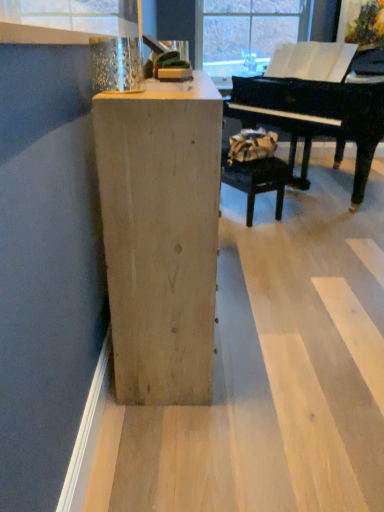
What is the approximate height of metallic glass at upper left?

It is 11.00 inches.

In order to face natural wood cabinet at center, should I rotate leftwards or rightwards?

A 2.473 degree turn to the left will do.

Measure the distance between leather-like brown bag at center and camera.

leather-like brown bag at center and camera are 9.96 feet apart from each other.

Where is `black polished piano at upper right`? black polished piano at upper right is located at coordinates (315, 109).

Are natural wood cabinet at center and metallic glass at upper left far apart?

That's not correct — natural wood cabinet at center is a little close to metallic glass at upper left.

Considering the points (163, 371) and (91, 6), which point is behind, point (163, 371) or point (91, 6)?

The point (163, 371) is behind.

How far apart are natural wood cabinet at center and metallic glass at upper left?

24.46 inches.

Is natural wood cabinet at center at the left side of metallic glass at upper left?

In fact, natural wood cabinet at center is to the right of metallic glass at upper left.

Between black polished piano at upper right and leather-like brown bag at center, which one appears on the left side from the viewer's perspective?

From the viewer's perspective, leather-like brown bag at center appears more on the left side.

Is black polished piano at upper right inside or outside of leather-like brown bag at center?

black polished piano at upper right cannot be found inside leather-like brown bag at center.

Can you confirm if black polished piano at upper right is wider than leather-like brown bag at center?

Yes, black polished piano at upper right is wider than leather-like brown bag at center.

Who is smaller, black polished piano at upper right or leather-like brown bag at center?

leather-like brown bag at center.

Is leather-like brown bag at center located outside natural wood cabinet at center?

That's correct, leather-like brown bag at center is outside of natural wood cabinet at center.

Does leather-like brown bag at center lie behind natural wood cabinet at center?

Yes, it is behind natural wood cabinet at center.

Is the surface of leather-like brown bag at center in direct contact with natural wood cabinet at center?

No, leather-like brown bag at center is not beside natural wood cabinet at center.

Is leather-like brown bag at center positioned with its back to natural wood cabinet at center?

leather-like brown bag at center is not turned away from natural wood cabinet at center.

Is leather-like brown bag at center aimed at metallic glass at upper left?

No, leather-like brown bag at center is not facing towards metallic glass at upper left.

Is leather-like brown bag at center taller than metallic glass at upper left?

Yes.

From a real-world perspective, which is physically above, leather-like brown bag at center or metallic glass at upper left?

metallic glass at upper left is physically above.

From the image's perspective, which one is positioned higher, leather-like brown bag at center or metallic glass at upper left?

From the image's view, metallic glass at upper left is above.

Which point is more forward, (76, 6) or (139, 98)?

The point (139, 98) is closer to the camera.

Considering the relative sizes of metallic glass at upper left and natural wood cabinet at center in the image provided, is metallic glass at upper left thinner than natural wood cabinet at center?

Yes.

Is metallic glass at upper left with natural wood cabinet at center?

No, metallic glass at upper left is not touching natural wood cabinet at center.

From the picture: Would you say metallic glass at upper left is to the left or to the right of natural wood cabinet at center in the picture?

metallic glass at upper left is to the left of natural wood cabinet at center.

Considering the sizes of objects black polished piano at upper right and metallic glass at upper left in the image provided, who is shorter, black polished piano at upper right or metallic glass at upper left?

metallic glass at upper left.

Which is in front, point (261, 101) or point (79, 9)?

The point (79, 9) is closer.

Is black polished piano at upper right bigger or smaller than metallic glass at upper left?

Considering their sizes, black polished piano at upper right takes up more space than metallic glass at upper left.

Is black polished piano at upper right positioned with its back to metallic glass at upper left?

No.

Does point (201, 321) lie in front of point (274, 65)?

Yes, point (201, 321) is closer to viewer.

How many degrees apart are the facing directions of natural wood cabinet at center and black polished piano at upper right?

The facing directions of natural wood cabinet at center and black polished piano at upper right are 143 degrees apart.

Which object is wider, natural wood cabinet at center or black polished piano at upper right?

black polished piano at upper right.

Considering the sizes of natural wood cabinet at center and black polished piano at upper right in the image, is natural wood cabinet at center taller or shorter than black polished piano at upper right?

natural wood cabinet at center is shorter than black polished piano at upper right.

Find the location of a particular element. The height and width of the screenshot is (512, 384). furniture lying on the right of metallic glass at upper left is located at coordinates (161, 236).

Identify the location of piano above the leather-like brown bag at center (from the image's perspective). Image resolution: width=384 pixels, height=512 pixels. (315, 109).

Based on their spatial positions, is metallic glass at upper left or black polished piano at upper right further from leather-like brown bag at center?

metallic glass at upper left is positioned further to the anchor leather-like brown bag at center.

From the image, which object appears to be farther from black polished piano at upper right, metallic glass at upper left or leather-like brown bag at center?

metallic glass at upper left is positioned further to the anchor black polished piano at upper right.

When comparing their distances from metallic glass at upper left, does leather-like brown bag at center or natural wood cabinet at center seem further?

leather-like brown bag at center.

Based on their spatial positions, is leather-like brown bag at center or metallic glass at upper left further from black polished piano at upper right?

The object further to black polished piano at upper right is metallic glass at upper left.

Based on their spatial positions, is metallic glass at upper left or natural wood cabinet at center closer to leather-like brown bag at center?

metallic glass at upper left.

When comparing their distances from metallic glass at upper left, does leather-like brown bag at center or black polished piano at upper right seem further?

Among the two, black polished piano at upper right is located further to metallic glass at upper left.

Based on their spatial positions, is natural wood cabinet at center or black polished piano at upper right closer to leather-like brown bag at center?

black polished piano at upper right is positioned closer to the anchor leather-like brown bag at center.

Considering their positions, is natural wood cabinet at center positioned closer to metallic glass at upper left than black polished piano at upper right?

natural wood cabinet at center is positioned closer to the anchor metallic glass at upper left.

Find the location of a particular element. The height and width of the screenshot is (512, 384). piano between metallic glass at upper left and leather-like brown bag at center in the front-back direction is located at coordinates (315, 109).

This screenshot has width=384, height=512. In order to click on furniture between metallic glass at upper left and leather-like brown bag at center in the front-back direction in this screenshot , I will do `click(161, 236)`.

Find the location of a particular element. The height and width of the screenshot is (512, 384). furniture between metallic glass at upper left and black polished piano at upper right from front to back is located at coordinates (161, 236).

The height and width of the screenshot is (512, 384). In order to click on piano between natural wood cabinet at center and leather-like brown bag at center in the front-back direction in this screenshot , I will do `click(315, 109)`.